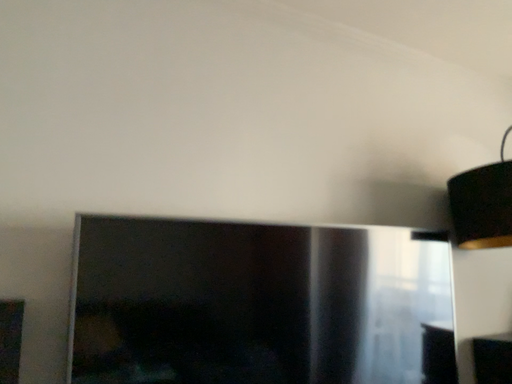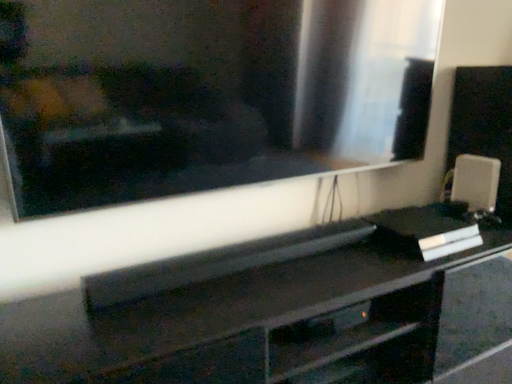
Question: Which way did the camera rotate in the video?

Choices:
 (A) rotated downward
 (B) rotated upward

Answer: (A)